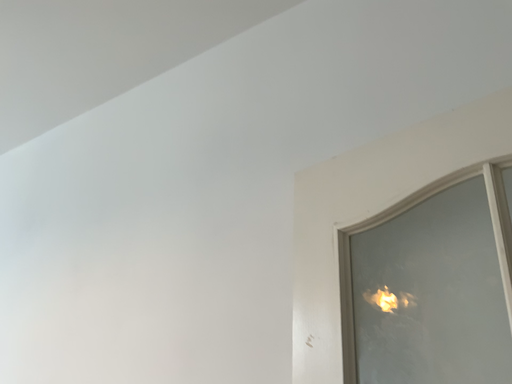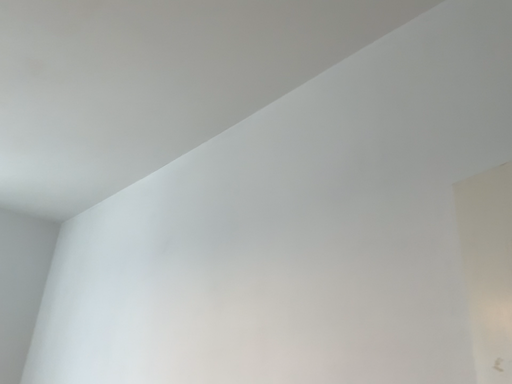
Question: Which way did the camera rotate in the video?

Choices:
 (A) rotated right
 (B) rotated left

Answer: (B)